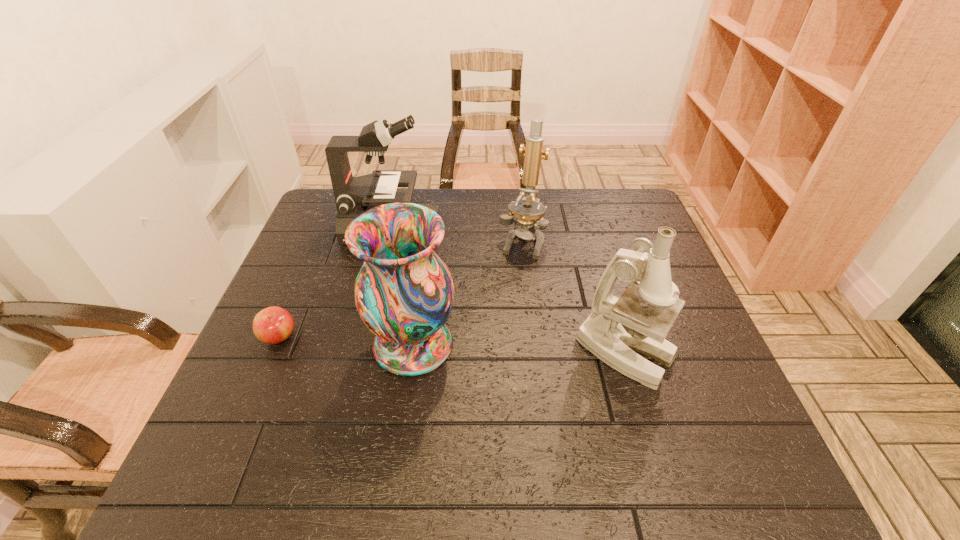
What are the coordinates of `blank space at the far right corner of the desktop` in the screenshot? It's located at (629, 200).

This screenshot has height=540, width=960. I want to click on vacant space that is in between the apple and the leftmost microscope, so click(x=335, y=282).

Identify the location of blank region between the second object from right to left and the rightmost microscope. This screenshot has height=540, width=960. (573, 297).

Find the location of a particular element. The height and width of the screenshot is (540, 960). free point between the rightmost microscope and the leftmost microscope is located at coordinates [x=508, y=291].

Where is `vacant space in between the rightmost microscope and the vase`? vacant space in between the rightmost microscope and the vase is located at coordinates (519, 349).

I want to click on free spot between the second microscope from left to right and the vase, so click(468, 293).

You are a GUI agent. You are given a task and a screenshot of the screen. Output one action in this format:
    pyautogui.click(x=<x>, y=<y>)
    Task: Click on the free point between the rightmost microscope and the fourth object from left to right
    Image resolution: width=960 pixels, height=540 pixels.
    Given the screenshot: What is the action you would take?
    pyautogui.click(x=573, y=297)

At what (x,y) coordinates should I click in order to perform the action: click on empty space between the rightmost microscope and the leftmost microscope. Please return your answer as a coordinate pair (x, y). Looking at the image, I should click on (508, 291).

Identify which object is the closest to the leftmost microscope. Please provide its 2D coordinates. Your answer should be formatted as a tuple, i.e. [(x, y)], where the tuple contains the x and y coordinates of a point satisfying the conditions above.

[(529, 211)]

I want to click on object that stands as the closest to the fourth object from left to right, so pyautogui.click(x=353, y=195).